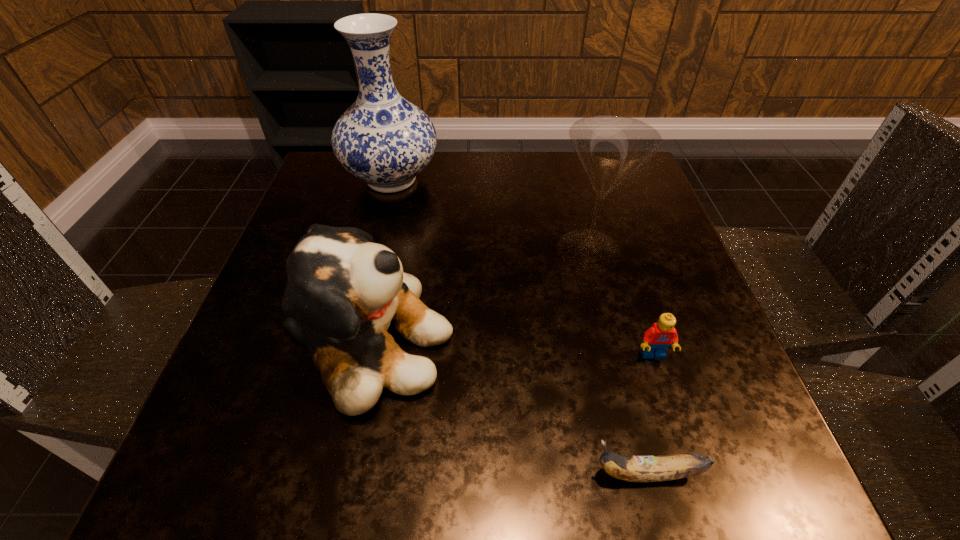
The image size is (960, 540). In order to click on object that stands as the third closest to the banana in this screenshot , I will do `click(611, 147)`.

The image size is (960, 540). Find the location of `object that is the closest to the Lego`. object that is the closest to the Lego is located at coordinates (668, 467).

The height and width of the screenshot is (540, 960). Identify the location of free space that satisfies the following two spatial constraints: 1. on the face of the Lego; 2. on the peel of the banana. (691, 474).

Locate an element on the screen. The height and width of the screenshot is (540, 960). free region that satisfies the following two spatial constraints: 1. on the front side of the flute glass; 2. at the face of the puppy is located at coordinates (612, 345).